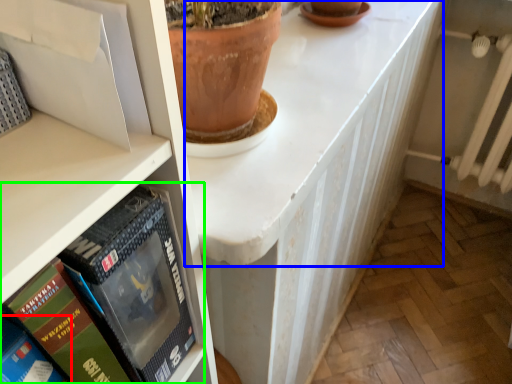
Question: Based on their relative distances, which object is farther from book (highlighted by a red box)? Choose from counter top (highlighted by a blue box) and book (highlighted by a green box).

Choices:
 (A) counter top
 (B) book

Answer: (A)